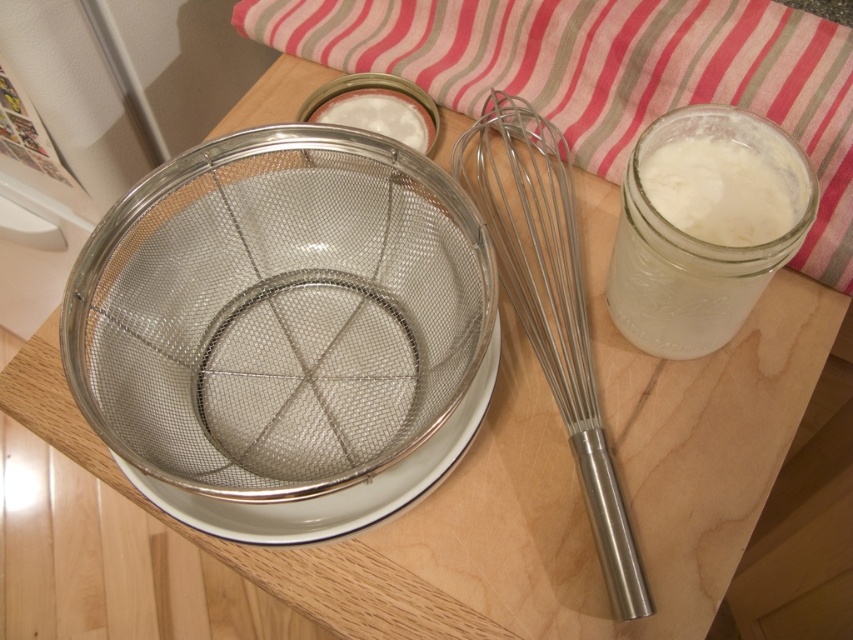
Question: Can you confirm if metallic mesh strainer at center is positioned to the right of white opaque liquid at right?

Choices:
 (A) no
 (B) yes

Answer: (A)

Question: Considering the real-world distances, which object is closest to the metallic silver whisk at center?

Choices:
 (A) white opaque liquid at right
 (B) metallic mesh strainer at center

Answer: (A)

Question: Which of the following is the farthest from the observer?

Choices:
 (A) metallic silver whisk at center
 (B) metallic mesh strainer at center
 (C) white opaque liquid at right

Answer: (A)

Question: Considering the relative positions of metallic mesh strainer at center and metallic silver whisk at center in the image provided, where is metallic mesh strainer at center located with respect to metallic silver whisk at center?

Choices:
 (A) below
 (B) above

Answer: (A)

Question: Among these points, which one is nearest to the camera?

Choices:
 (A) (393, 349)
 (B) (520, 188)
 (C) (728, 250)

Answer: (C)

Question: Does metallic silver whisk at center have a greater width compared to white opaque liquid at right?

Choices:
 (A) no
 (B) yes

Answer: (B)